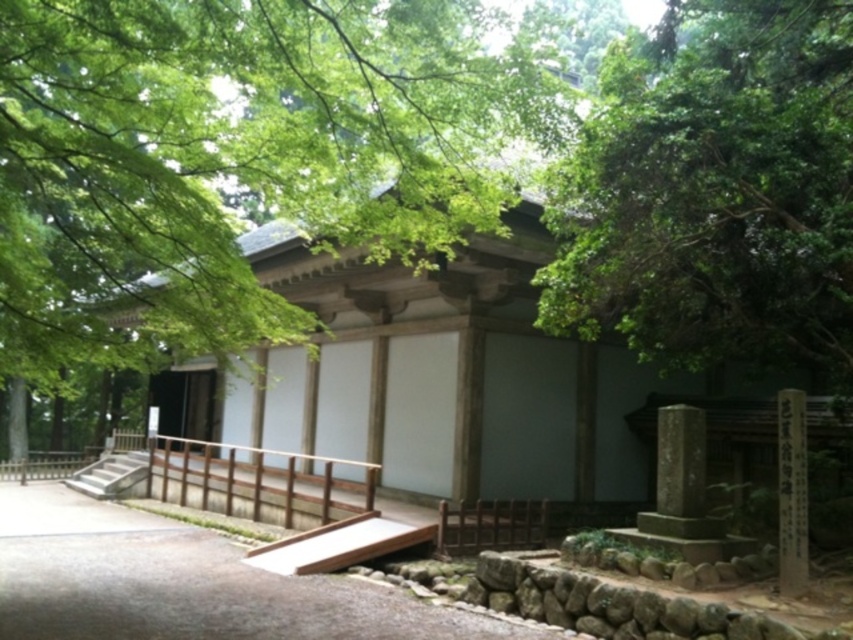
Is brown gravel path at center positioned before gray concrete stairs at lower left?

Yes, it is.

Does brown gravel path at center appear over gray concrete stairs at lower left?

Yes.

Does point (108, 582) come behind point (109, 477)?

No, it is in front of (109, 477).

You are a GUI agent. You are given a task and a screenshot of the screen. Output one action in this format:
    pyautogui.click(x=<x>, y=<y>)
    Task: Click on the brown gravel path at center
    
    Given the screenshot: What is the action you would take?
    pyautogui.click(x=184, y=582)

Describe the element at coordinates (236, 157) in the screenshot. The height and width of the screenshot is (640, 853). I see `green leafy tree at center` at that location.

Can you confirm if green leafy tree at center is positioned above brown wooden rail at center?

Correct, green leafy tree at center is located above brown wooden rail at center.

Find the location of a particular element. Image resolution: width=853 pixels, height=640 pixels. green leafy tree at center is located at coordinates point(236,157).

Can you confirm if brown gravel path at center is wider than brown wooden rail at center?

Indeed, brown gravel path at center has a greater width compared to brown wooden rail at center.

Who is lower down, brown gravel path at center or brown wooden rail at center?

brown gravel path at center is lower down.

Which is in front, point (151, 616) or point (128, 486)?

Positioned in front is point (151, 616).

Locate an element on the screen. The height and width of the screenshot is (640, 853). brown gravel path at center is located at coordinates (184, 582).